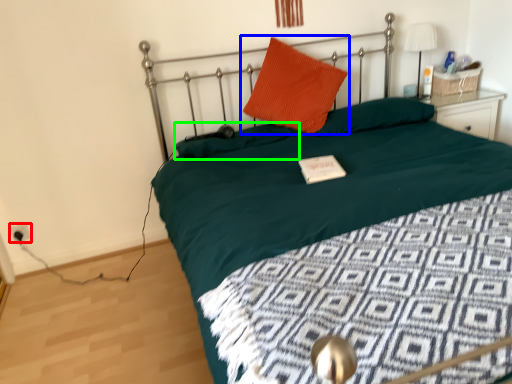
Question: Which is nearer to the electric outlet (highlighted by a red box)? pillow (highlighted by a blue box) or pillow (highlighted by a green box).

Choices:
 (A) pillow
 (B) pillow

Answer: (B)